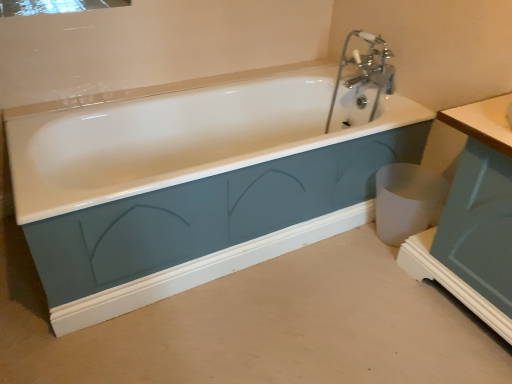
Question: From a real-world perspective, is clear glass mirror at upper left below white glossy bathtub at center?

Choices:
 (A) no
 (B) yes

Answer: (A)

Question: Considering the relative positions of clear glass mirror at upper left and white glossy bathtub at center in the image provided, is clear glass mirror at upper left to the right of white glossy bathtub at center from the viewer's perspective?

Choices:
 (A) no
 (B) yes

Answer: (A)

Question: Considering the relative positions of clear glass mirror at upper left and white glossy bathtub at center in the image provided, is clear glass mirror at upper left in front of white glossy bathtub at center?

Choices:
 (A) yes
 (B) no

Answer: (B)

Question: Are clear glass mirror at upper left and white glossy bathtub at center beside each other?

Choices:
 (A) no
 (B) yes

Answer: (A)

Question: Does clear glass mirror at upper left have a greater width compared to white glossy bathtub at center?

Choices:
 (A) no
 (B) yes

Answer: (A)

Question: From a real-world perspective, is clear glass mirror at upper left physically above white glossy bathtub at center?

Choices:
 (A) yes
 (B) no

Answer: (A)

Question: Considering the relative sizes of matte teal cabinet at right and clear glass mirror at upper left in the image provided, is matte teal cabinet at right shorter than clear glass mirror at upper left?

Choices:
 (A) no
 (B) yes

Answer: (A)

Question: Considering the relative sizes of matte teal cabinet at right and clear glass mirror at upper left in the image provided, is matte teal cabinet at right wider than clear glass mirror at upper left?

Choices:
 (A) no
 (B) yes

Answer: (B)

Question: Is matte teal cabinet at right smaller than clear glass mirror at upper left?

Choices:
 (A) yes
 (B) no

Answer: (B)

Question: Does matte teal cabinet at right lie in front of clear glass mirror at upper left?

Choices:
 (A) yes
 (B) no

Answer: (A)

Question: Is clear glass mirror at upper left surrounded by matte teal cabinet at right?

Choices:
 (A) no
 (B) yes

Answer: (A)

Question: Can you see matte teal cabinet at right touching clear glass mirror at upper left?

Choices:
 (A) yes
 (B) no

Answer: (B)

Question: Does white matte trash can at lower right have a greater width compared to clear glass mirror at upper left?

Choices:
 (A) no
 (B) yes

Answer: (A)